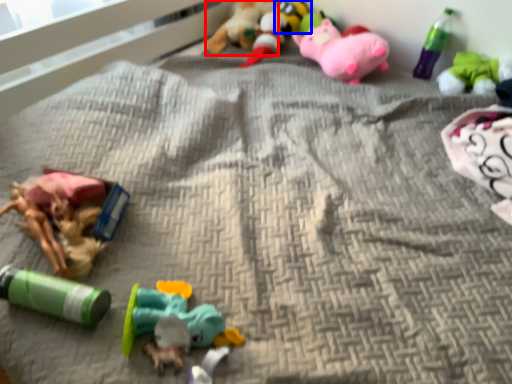
Question: Which object appears closest to the camera in this image, toy (highlighted by a red box) or toy (highlighted by a blue box)?

Choices:
 (A) toy
 (B) toy

Answer: (A)